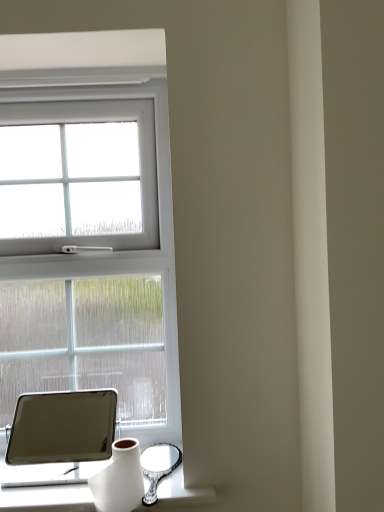
This screenshot has height=512, width=384. Find the location of `vacant space to the right of matte black tablet at lower left`. vacant space to the right of matte black tablet at lower left is located at coordinates (162, 465).